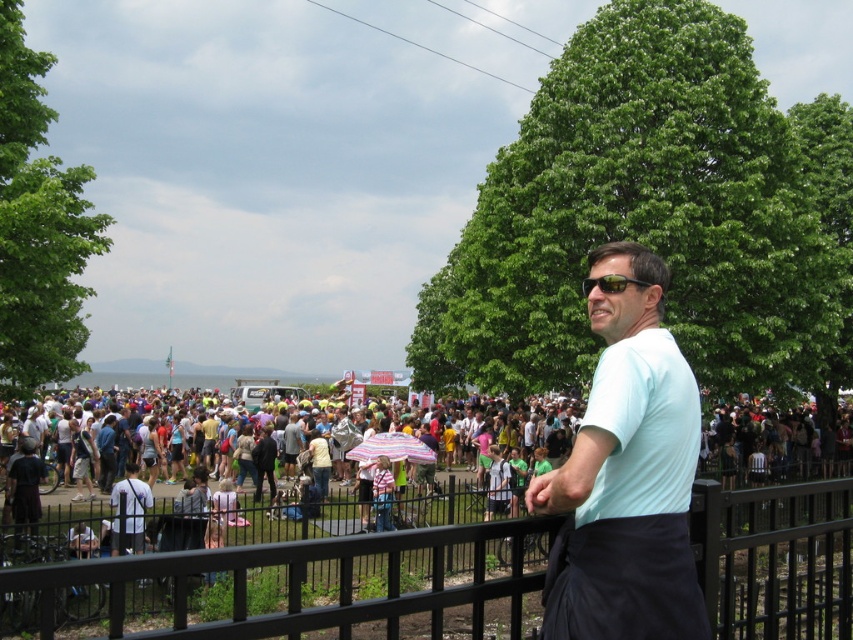
You are a photographer at the event and want to capture a photo of the light blue shirt at center and the striped fabric umbrella at center. Which object should you focus on first if you want to ensure both are in frame without moving the camera?

You should focus on the light blue shirt at center first because it is taller than the striped fabric umbrella at center, so it will be easier to frame both by adjusting the camera angle to include the taller object first.

You are attending an outdoor event and want to take a photo of the crowd without any obstructions. You have a clear view of the black metal fence at center and the striped fabric umbrella at center. Which object should you position behind to ensure the other is not blocking your shot?

To avoid obstruction, position the striped fabric umbrella at center behind the black metal fence at center since the black metal fence at center is located below the striped fabric umbrella at center, meaning the umbrella is above the fence and would block the view if not placed properly.